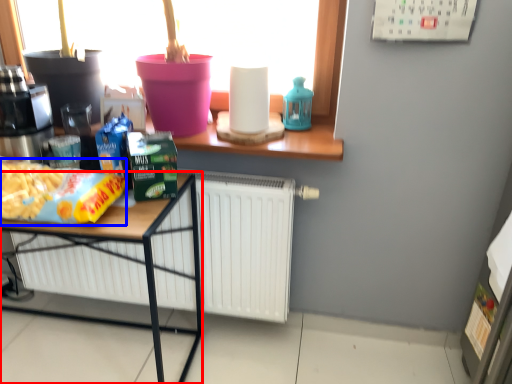
Question: Which point is further to the camera, desk (highlighted by a red box) or food (highlighted by a blue box)?

Choices:
 (A) desk
 (B) food

Answer: (A)